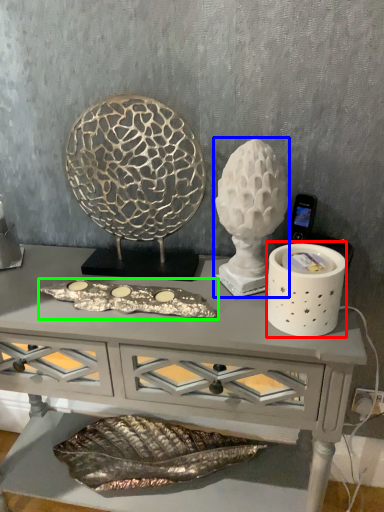
Question: Which object is the farthest from candle holder (highlighted by a red box)? Choose among these: sculpture (highlighted by a blue box) or art (highlighted by a green box).

Choices:
 (A) sculpture
 (B) art

Answer: (B)